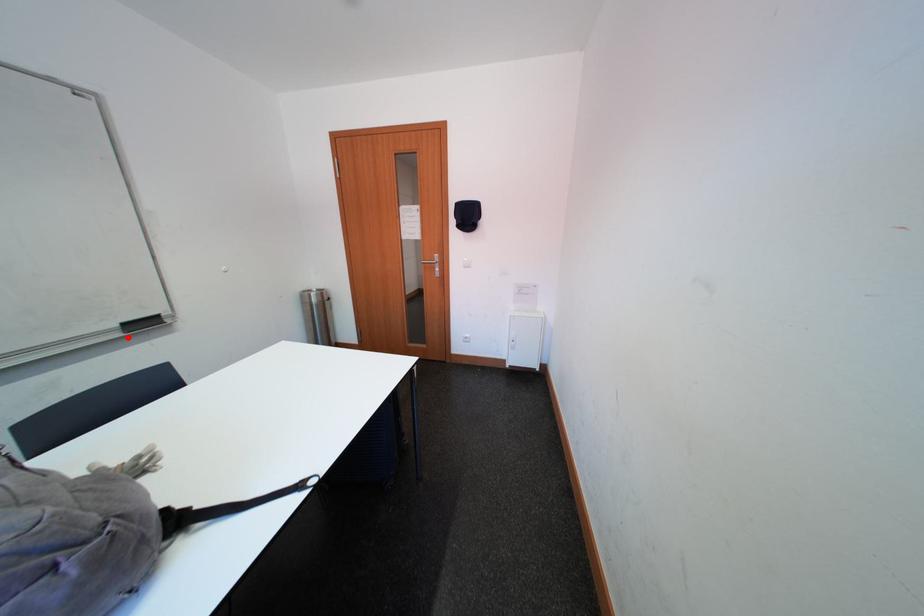
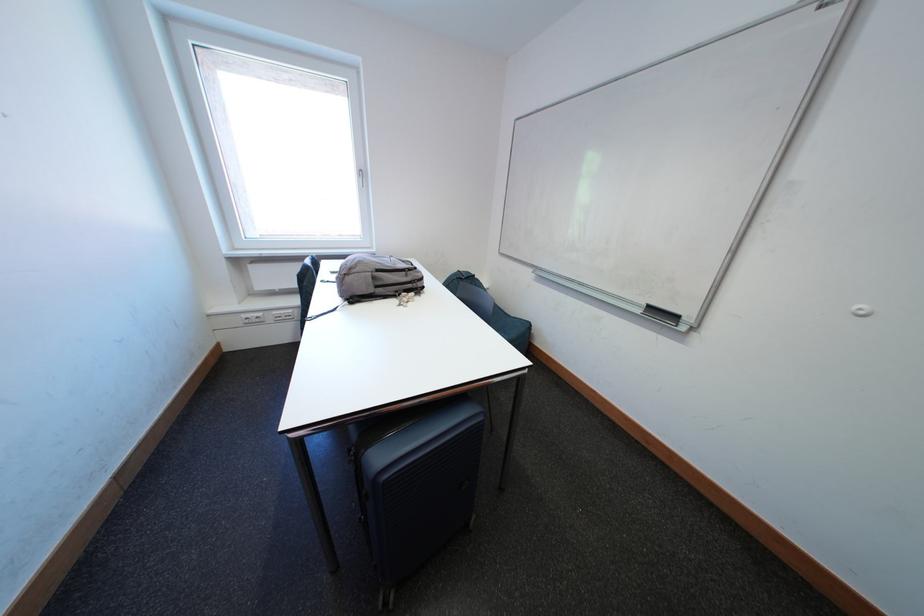
Question: I am providing you with two images of the same scene from different viewpoints. A red point is shown in image1. For the corresponding object point in image2, is it positioned nearer or farther from the camera?

Choices:
 (A) Nearer
 (B) Farther

Answer: (A)